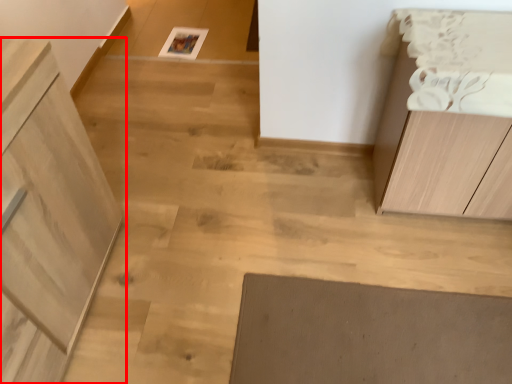
Question: From the image's perspective, what is the correct spatial positioning of cabinetry (annotated by the red box) in reference to cabinetry?

Choices:
 (A) below
 (B) above

Answer: (A)